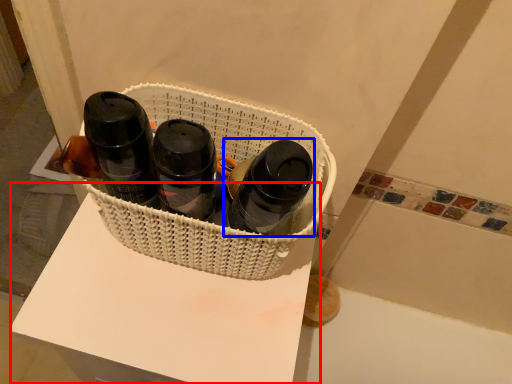
Question: Which object appears farthest to the camera in this image, table (highlighted by a red box) or bottle (highlighted by a blue box)?

Choices:
 (A) table
 (B) bottle

Answer: (A)